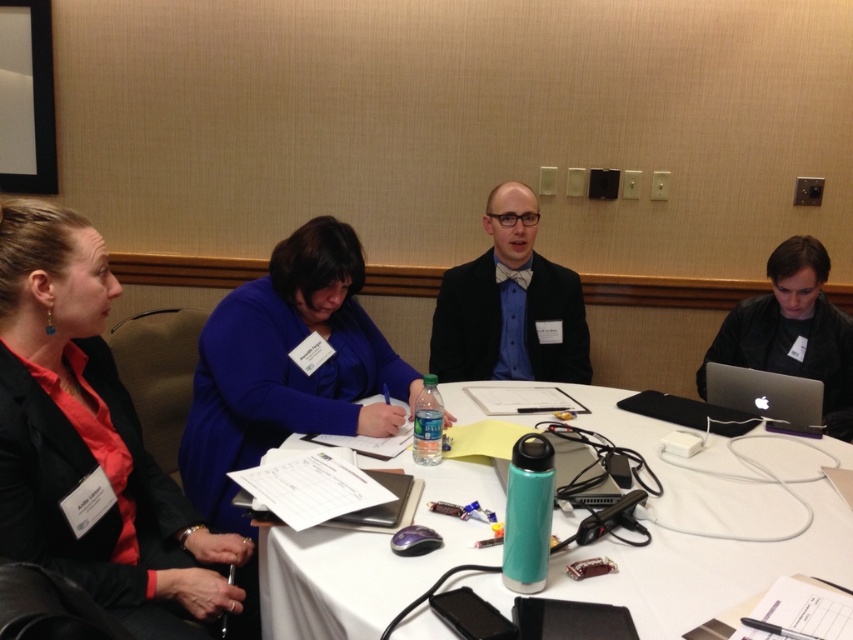
You are standing in front of the table and want to reach both the point at coordinates (x=585, y=353) and the point at coordinates (x=798, y=340). Which point will you reach first?

You will reach point (x=585, y=353) first because it is closer to you than point (x=798, y=340), which is further away.

You are a photographer taking a portrait of the group seated around the rectangular table. You want to ensure that both the matte black bow tie at center and the black matte laptop at right are clearly visible in the photo. Based on their positions, which object will appear higher in the frame?

The matte black bow tie at center is located above the black matte laptop at right, so it will appear higher in the frame.

You are attending a meeting and need to access the black matte laptop at right. However, there is a matte black bow tie at center in your way. Can you reach the laptop without moving the bow tie?

The black matte laptop at right is behind the matte black bow tie at center, so you can reach it without moving the bow tie by going around it or accessing it from the side.